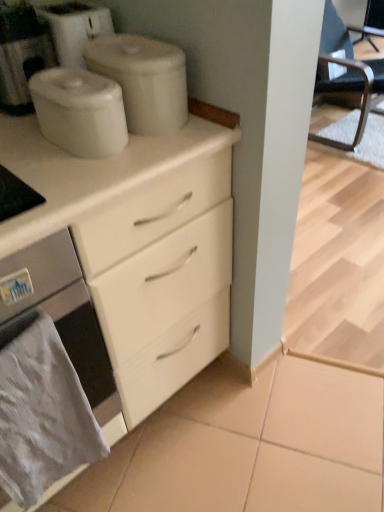
Question: Is gray fabric towel at lower left positioned with its back to satin white oven at lower left?

Choices:
 (A) yes
 (B) no

Answer: (A)

Question: Is gray fabric towel at lower left positioned behind satin white oven at lower left?

Choices:
 (A) no
 (B) yes

Answer: (B)

Question: Are gray fabric towel at lower left and satin white oven at lower left beside each other?

Choices:
 (A) no
 (B) yes

Answer: (A)

Question: Is gray fabric towel at lower left taller than satin white oven at lower left?

Choices:
 (A) yes
 (B) no

Answer: (B)

Question: From the image's perspective, does gray fabric towel at lower left appear higher than satin white oven at lower left?

Choices:
 (A) no
 (B) yes

Answer: (A)

Question: Is white glossy container at upper center, the 1th appliance viewed from the front, spatially inside black leather chair at right, or outside of it?

Choices:
 (A) outside
 (B) inside

Answer: (A)

Question: Looking at their shapes, would you say white glossy container at upper center, acting as the 2th appliance starting from the back, is wider or thinner than black leather chair at right?

Choices:
 (A) wide
 (B) thin

Answer: (B)

Question: From a real-world perspective, relative to black leather chair at right, is white glossy container at upper center, the 1th appliance viewed from the front, vertically above or below?

Choices:
 (A) above
 (B) below

Answer: (A)

Question: Visually, is white glossy container at upper center, the 1th appliance viewed from the front, positioned to the left or to the right of black leather chair at right?

Choices:
 (A) right
 (B) left

Answer: (B)

Question: Do you think black leather chair at right is within white matte containers at upper center, the second appliance when ordered from front to back, or outside of it?

Choices:
 (A) inside
 (B) outside

Answer: (B)

Question: Based on their positions, is black leather chair at right located to the left or right of white matte containers at upper center, the second appliance when ordered from front to back?

Choices:
 (A) right
 (B) left

Answer: (A)

Question: Considering the positions of black leather chair at right and white matte containers at upper center, the 1th appliance viewed from the back, in the image, is black leather chair at right taller or shorter than white matte containers at upper center, the 1th appliance viewed from the back,?

Choices:
 (A) tall
 (B) short

Answer: (A)

Question: From a real-world perspective, is black leather chair at right above or below white matte containers at upper center, the 1th appliance viewed from the back?

Choices:
 (A) below
 (B) above

Answer: (A)

Question: Is black leather chair at right taller or shorter than white matte coffee machine at upper left?

Choices:
 (A) tall
 (B) short

Answer: (A)

Question: Is black leather chair at right wider or thinner than white matte coffee machine at upper left?

Choices:
 (A) wide
 (B) thin

Answer: (A)